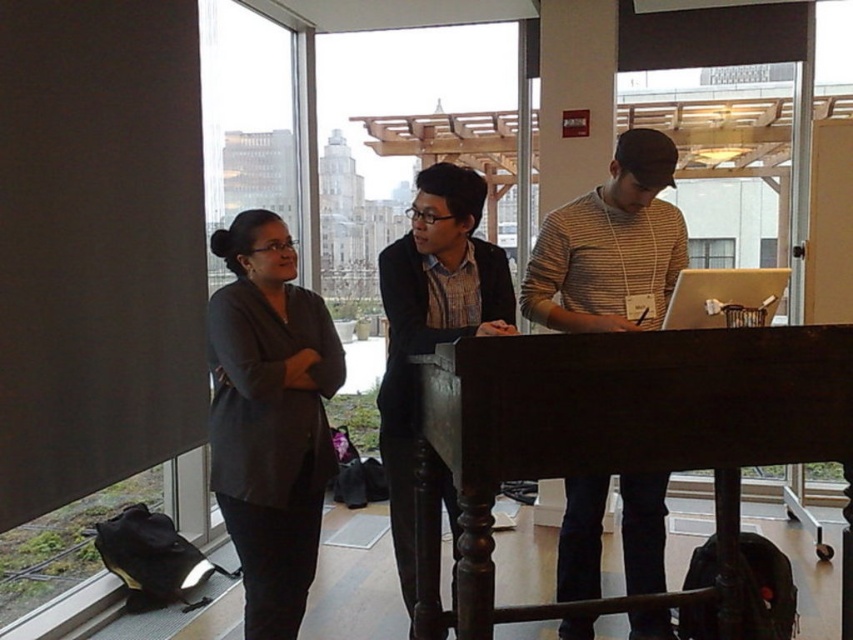
Which is more to the right, dark gray blazer at left or matte black shirt at center?

matte black shirt at center is more to the right.

In the scene shown: Is the position of dark gray blazer at left more distant than that of matte black shirt at center?

Yes, dark gray blazer at left is behind matte black shirt at center.

I want to click on dark gray blazer at left, so click(270, 417).

Can you confirm if striped sweater at center is thinner than matte black laptop at center?

Incorrect, striped sweater at center's width is not less than matte black laptop at center's.

Does striped sweater at center come in front of matte black laptop at center?

No, striped sweater at center is further to the viewer.

Where is `striped sweater at center`? This screenshot has width=853, height=640. striped sweater at center is located at coordinates (610, 246).

This screenshot has width=853, height=640. Identify the location of striped sweater at center. [610, 246].

Consider the image. Is dark wood balustrade at center closer to camera compared to striped sweater at center?

That is True.

Which is more to the left, dark wood balustrade at center or striped sweater at center?

dark wood balustrade at center is more to the left.

Between point (683, 593) and point (631, 284), which one is positioned in front?

Point (683, 593)

You are a GUI agent. You are given a task and a screenshot of the screen. Output one action in this format:
    pyautogui.click(x=<x>, y=<y>)
    Task: Click on the dark wood balustrade at center
    
    Given the screenshot: What is the action you would take?
    pyautogui.click(x=614, y=436)